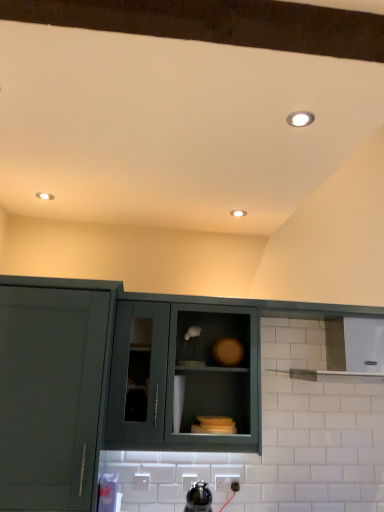
Question: Is matte green cabinet at center, the second cabinetry in the left-to-right sequence, completely or partially outside of matte green cabinet at center, arranged as the 3th cabinetry when viewed from the left?

Choices:
 (A) no
 (B) yes

Answer: (B)

Question: From the image's perspective, is matte green cabinet at center, the second cabinetry in the left-to-right sequence, beneath matte green cabinet at center, arranged as the 3th cabinetry when viewed from the left?

Choices:
 (A) yes
 (B) no

Answer: (B)

Question: From the image's perspective, is matte green cabinet at center, the second cabinetry in the left-to-right sequence, over matte green cabinet at center, the 1th cabinetry in the right-to-left sequence?

Choices:
 (A) yes
 (B) no

Answer: (A)

Question: From a real-world perspective, is matte green cabinet at center, the second cabinetry in the left-to-right sequence, physically above matte green cabinet at center, arranged as the 3th cabinetry when viewed from the left?

Choices:
 (A) yes
 (B) no

Answer: (A)

Question: Is matte green cabinet at center, the second cabinetry from the right, far away from matte green cabinet at center, arranged as the 3th cabinetry when viewed from the left?

Choices:
 (A) no
 (B) yes

Answer: (A)

Question: From a real-world perspective, is white plastic electric outlet at lower center positioned above or below matte green cabinet at center, the second cabinetry from the right?

Choices:
 (A) below
 (B) above

Answer: (A)

Question: Considering the positions of point (218, 478) and point (165, 323), is point (218, 478) closer or farther from the camera than point (165, 323)?

Choices:
 (A) closer
 (B) farther

Answer: (B)

Question: Is white plastic electric outlet at lower center wider or thinner than matte green cabinet at center, the second cabinetry from the right?

Choices:
 (A) thin
 (B) wide

Answer: (A)

Question: Would you say white plastic electric outlet at lower center is to the left or to the right of matte green cabinet at center, the second cabinetry in the left-to-right sequence, in the picture?

Choices:
 (A) left
 (B) right

Answer: (B)

Question: Considering the positions of point (168, 336) and point (299, 125), is point (168, 336) closer or farther from the camera than point (299, 125)?

Choices:
 (A) farther
 (B) closer

Answer: (A)

Question: From the image's perspective, is matte green cabinet at center, the second cabinetry from the right, located above or below white glossy light fixture at upper right?

Choices:
 (A) below
 (B) above

Answer: (A)

Question: From their relative heights in the image, would you say matte green cabinet at center, the second cabinetry in the left-to-right sequence, is taller or shorter than white glossy light fixture at upper right?

Choices:
 (A) short
 (B) tall

Answer: (B)

Question: Do you think matte green cabinet at center, the second cabinetry in the left-to-right sequence, is within white glossy light fixture at upper right, or outside of it?

Choices:
 (A) inside
 (B) outside

Answer: (B)

Question: In the image, is matte green cabinet at center, the second cabinetry from the right, positioned in front of or behind matte green cabinet at center, arranged as the 3th cabinetry when viewed from the left?

Choices:
 (A) front
 (B) behind

Answer: (A)

Question: From a real-world perspective, is matte green cabinet at center, the second cabinetry from the right, positioned above or below matte green cabinet at center, arranged as the 3th cabinetry when viewed from the left?

Choices:
 (A) below
 (B) above

Answer: (B)